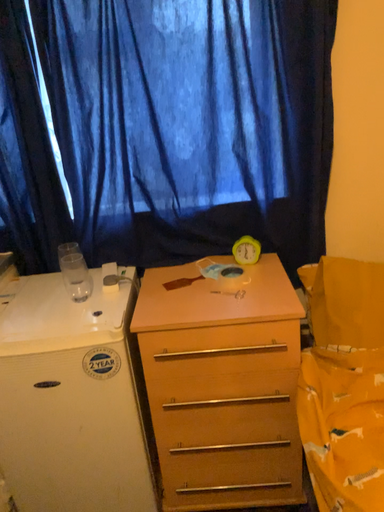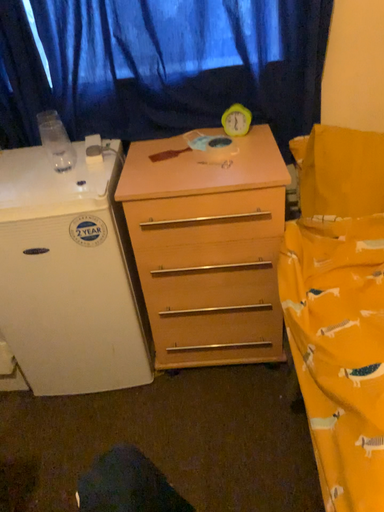
Question: Which way did the camera rotate in the video?

Choices:
 (A) rotated upward
 (B) rotated downward

Answer: (B)